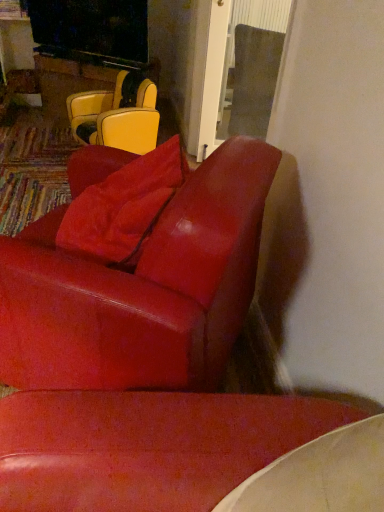
Question: Should I look upward or downward to see suede-like red pillow at upper center?

Choices:
 (A) up
 (B) down

Answer: (A)

Question: In which direction should I rotate to look at glossy leather chair at center, the second chair in the top-to-bottom sequence?

Choices:
 (A) right
 (B) left

Answer: (B)

Question: From the image's perspective, is matte yellow leather chair at upper left, the 2th chair from the front, under glossy leather chair at center, which is counted as the 1th chair, starting from the bottom?

Choices:
 (A) no
 (B) yes

Answer: (A)

Question: Can you confirm if matte yellow leather chair at upper left, which is the 1th chair in top-to-bottom order, is positioned to the right of glossy leather chair at center, which ranks as the second chair in back-to-front order?

Choices:
 (A) yes
 (B) no

Answer: (B)

Question: Does matte yellow leather chair at upper left, which is the 1th chair in top-to-bottom order, come in front of glossy leather chair at center, the first chair positioned from the front?

Choices:
 (A) no
 (B) yes

Answer: (A)

Question: Does matte yellow leather chair at upper left, which is the 1th chair in top-to-bottom order, turn towards glossy leather chair at center, which is counted as the 1th chair, starting from the bottom?

Choices:
 (A) yes
 (B) no

Answer: (B)

Question: Is matte yellow leather chair at upper left, the second chair from the bottom, completely or partially outside of glossy leather chair at center, which is counted as the 1th chair, starting from the bottom?

Choices:
 (A) no
 (B) yes

Answer: (B)

Question: Does matte yellow leather chair at upper left, the second chair from the bottom, have a larger size compared to glossy leather chair at center, which is counted as the 1th chair, starting from the bottom?

Choices:
 (A) no
 (B) yes

Answer: (A)

Question: Is suede-like red pillow at upper center positioned behind glossy leather chair at center, which ranks as the second chair in back-to-front order?

Choices:
 (A) yes
 (B) no

Answer: (A)

Question: Does suede-like red pillow at upper center contain glossy leather chair at center, which is counted as the 1th chair, starting from the bottom?

Choices:
 (A) no
 (B) yes

Answer: (A)

Question: Is suede-like red pillow at upper center thinner than glossy leather chair at center, which is counted as the 1th chair, starting from the bottom?

Choices:
 (A) no
 (B) yes

Answer: (B)

Question: Can you confirm if suede-like red pillow at upper center is taller than glossy leather chair at center, which is counted as the 1th chair, starting from the bottom?

Choices:
 (A) no
 (B) yes

Answer: (A)

Question: Does suede-like red pillow at upper center appear on the right side of glossy leather chair at center, which is counted as the 1th chair, starting from the bottom?

Choices:
 (A) no
 (B) yes

Answer: (B)

Question: From a real-world perspective, is suede-like red pillow at upper center located higher than glossy leather chair at center, which ranks as the second chair in back-to-front order?

Choices:
 (A) yes
 (B) no

Answer: (A)

Question: Is glossy leather chair at center, the second chair in the top-to-bottom sequence, next to matte yellow leather chair at upper left, which is the 1th chair in top-to-bottom order, and touching it?

Choices:
 (A) yes
 (B) no

Answer: (B)